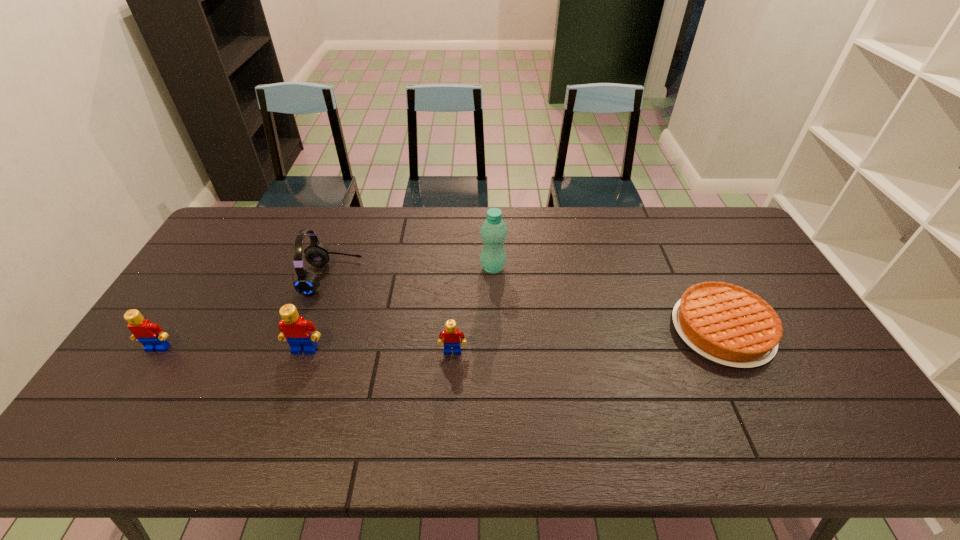
You are a GUI agent. You are given a task and a screenshot of the screen. Output one action in this format:
    pyautogui.click(x=<x>, y=<y>)
    Task: Click on the vacant area between the second Lego from left to right and the fifth tallest object
    Image resolution: width=960 pixels, height=540 pixels.
    Given the screenshot: What is the action you would take?
    pyautogui.click(x=379, y=350)

The height and width of the screenshot is (540, 960). What are the coordinates of `object that is the closest to the headset` in the screenshot? It's located at pos(295,329).

Locate an element on the screen. The width and height of the screenshot is (960, 540). the third closest object to the leftmost Lego is located at coordinates (451, 336).

The image size is (960, 540). What are the coordinates of `the third closest Lego relative to the rightmost object` in the screenshot? It's located at tap(151, 335).

Choose which Lego is the second nearest neighbor to the headset. Please provide its 2D coordinates. Your answer should be formatted as a tuple, i.e. [(x, y)], where the tuple contains the x and y coordinates of a point satisfying the conditions above.

[(151, 335)]

Find the location of a particular element. This screenshot has height=540, width=960. blank space that satisfies the following two spatial constraints: 1. on the front side of the second object from right to left; 2. on the left side of the shortest object is located at coordinates (495, 330).